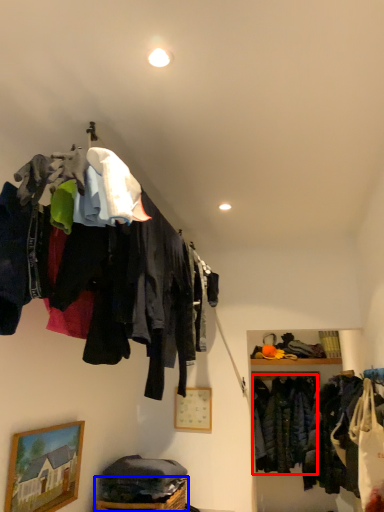
Question: Which object is further to the camera taking this photo, clothing (highlighted by a red box) or basket (highlighted by a blue box)?

Choices:
 (A) clothing
 (B) basket

Answer: (A)